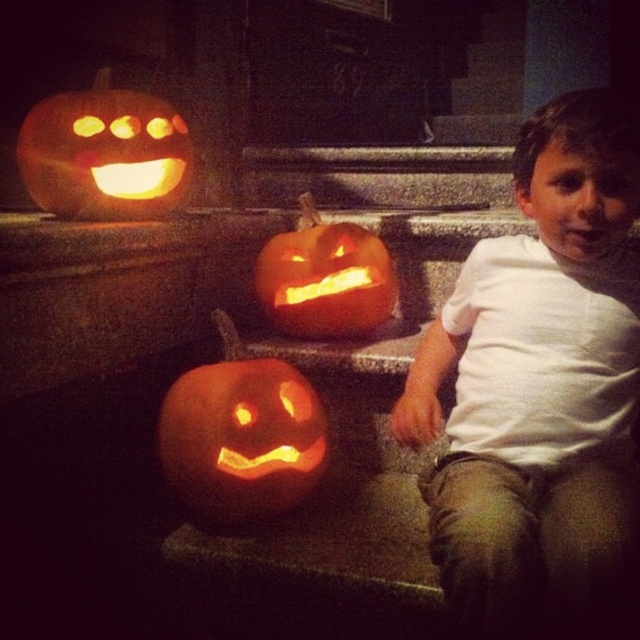
You are a child trying to decide which pumpkin to choose between the matte orange pumpkin at upper left and the orange matte pumpkin at center. Which pumpkin is wider?

The matte orange pumpkin at upper left is wider than the orange matte pumpkin at center because its width surpasses the other.

You are a child who wants to place a small toy between the matte orange pumpkin at upper left and the orange matte pumpkin at center. Can you fit it there if the toy is 15 inches long?

The distance between the matte orange pumpkin at upper left and the orange matte pumpkin at center is 15.83 inches, so the 15 inch toy can fit between them since it is shorter than the space available.